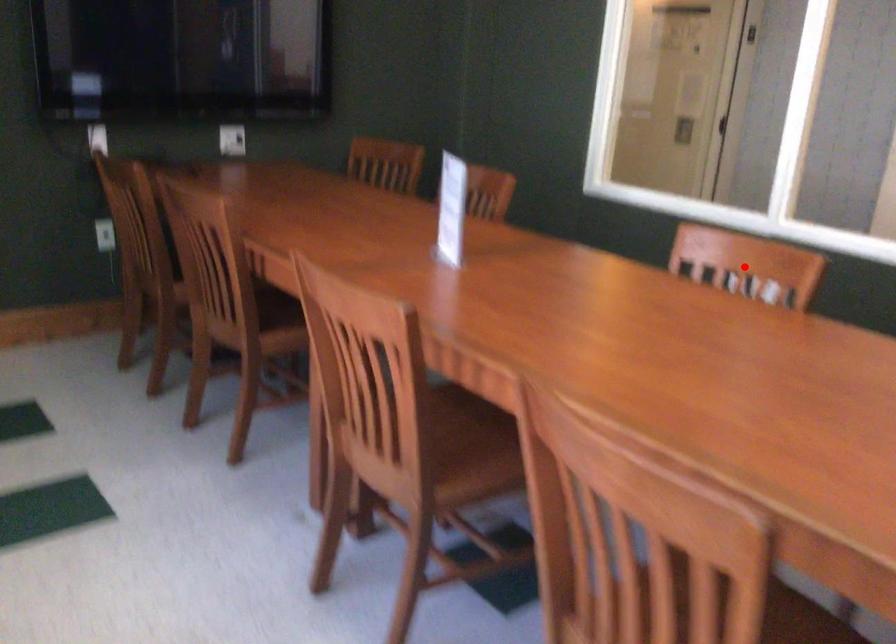
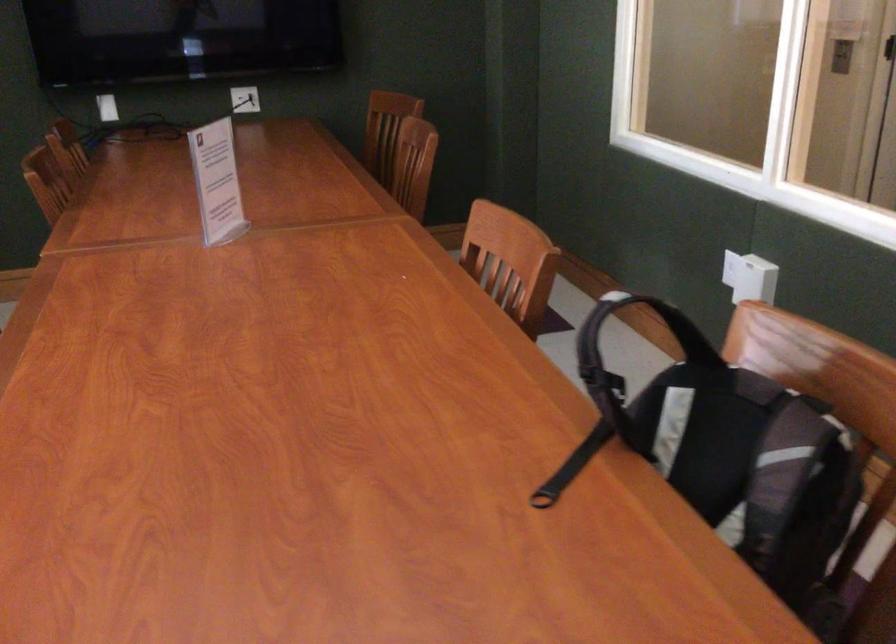
Where in the second image is the point corresponding to the highlighted location from the first image?

(510, 261)